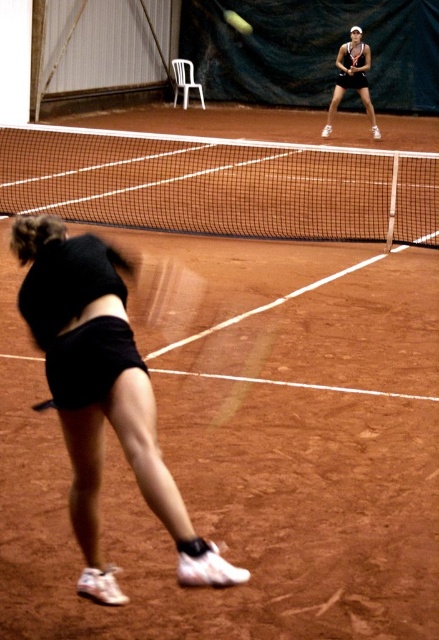
Is the position of matte black tennis racket at upper center less distant than that of yellow matte tennis ball at center?

Yes, matte black tennis racket at upper center is in front of yellow matte tennis ball at center.

Is point (345, 56) more distant than point (245, 33)?

No, it is in front of (245, 33).

Between point (338, 100) and point (244, 24), which one is positioned behind?

The point (244, 24) is behind.

At what (x,y) coordinates should I click in order to perform the action: click on matte black tennis racket at upper center. Please return your answer as a coordinate pair (x, y). Looking at the image, I should click on (352, 77).

Does black matte shorts at lower left have a greater height compared to yellow matte tennis ball at center?

Yes, black matte shorts at lower left is taller than yellow matte tennis ball at center.

Which is more to the left, black matte shorts at lower left or yellow matte tennis ball at center?

black matte shorts at lower left

This screenshot has height=640, width=439. Find the location of `black matte shorts at lower left`. black matte shorts at lower left is located at coordinates (101, 392).

Does black mesh tennis net at center have a smaller size compared to yellow matte tennis ball at center?

Actually, black mesh tennis net at center might be larger than yellow matte tennis ball at center.

Can you confirm if black mesh tennis net at center is positioned to the right of yellow matte tennis ball at center?

In fact, black mesh tennis net at center is to the left of yellow matte tennis ball at center.

Locate an element on the screen. black mesh tennis net at center is located at coordinates (219, 186).